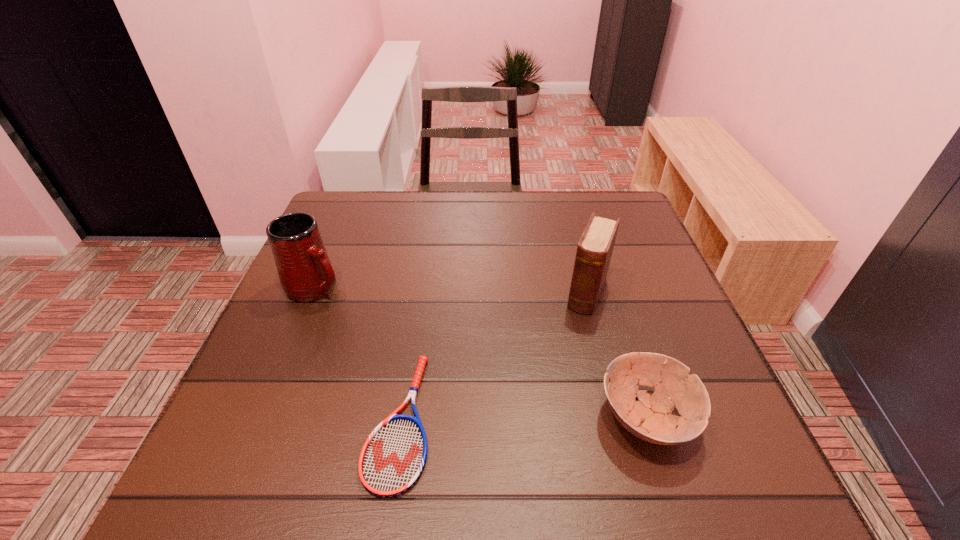
You are a GUI agent. You are given a task and a screenshot of the screen. Output one action in this format:
    pyautogui.click(x=<x>, y=<y>)
    Task: Click on the vacant space located on the side of the mug with the handle
    The height and width of the screenshot is (540, 960).
    Given the screenshot: What is the action you would take?
    pyautogui.click(x=386, y=325)

You are a GUI agent. You are given a task and a screenshot of the screen. Output one action in this format:
    pyautogui.click(x=<x>, y=<y>)
    Task: Click on the free location located on the side of the mug with the handle
    The height and width of the screenshot is (540, 960).
    Given the screenshot: What is the action you would take?
    pyautogui.click(x=464, y=369)

At what (x,y) coordinates should I click in order to perform the action: click on free point located on the side of the mug with the handle. Please return your answer as a coordinate pair (x, y). Looking at the image, I should click on (370, 315).

What are the coordinates of `tennis racket present at the near edge` in the screenshot? It's located at [x=392, y=459].

Where is `bowl that is at the near edge`? Image resolution: width=960 pixels, height=540 pixels. bowl that is at the near edge is located at coordinates (650, 418).

Locate an element on the screen. object present at the left edge is located at coordinates (306, 274).

The height and width of the screenshot is (540, 960). What are the coordinates of `bowl present at the right edge` in the screenshot? It's located at (650, 418).

In order to click on diary that is at the right edge in this screenshot , I will do `click(594, 251)`.

Where is `object located at the near right corner`? The width and height of the screenshot is (960, 540). object located at the near right corner is located at coordinates (650, 418).

Identify the location of free spot at the far edge of the desktop. (481, 192).